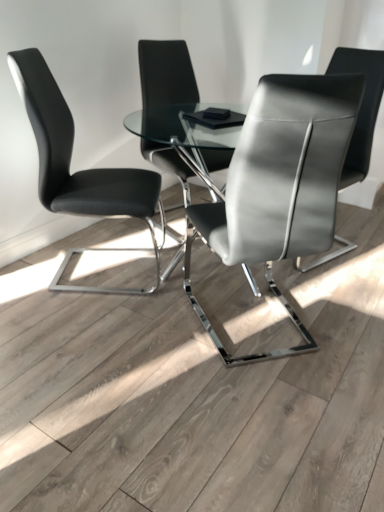
What do you see at coordinates (166, 75) in the screenshot? I see `matte black chair at center, the second chair positioned from the left` at bounding box center [166, 75].

At what (x,y) coordinates should I click in order to perform the action: click on black leather chair at left, which is counted as the 1th chair, starting from the left. Please return your answer as a coordinate pair (x, y). The image size is (384, 512). Looking at the image, I should click on [x=79, y=170].

This screenshot has width=384, height=512. What are the coordinates of `matte black chair at center, arranged as the third chair when viewed from the right` in the screenshot? It's located at (166, 75).

From the image's perspective, who appears lower, matte black chair at center, the second chair positioned from the left, or black leather chair at left, which is counted as the 1th chair, starting from the left?

black leather chair at left, which is counted as the 1th chair, starting from the left, is shown below in the image.

Considering the relative positions of matte black chair at center, arranged as the third chair when viewed from the right, and black leather chair at left, which appears as the fourth chair when viewed from the right, in the image provided, is matte black chair at center, arranged as the third chair when viewed from the right, to the left of black leather chair at left, which appears as the fourth chair when viewed from the right, from the viewer's perspective?

In fact, matte black chair at center, arranged as the third chair when viewed from the right, is to the right of black leather chair at left, which appears as the fourth chair when viewed from the right.

Is matte black chair at center, the second chair positioned from the left, further to the viewer compared to black leather chair at left, which appears as the fourth chair when viewed from the right?

Yes, the depth of matte black chair at center, the second chair positioned from the left, is greater than that of black leather chair at left, which appears as the fourth chair when viewed from the right.

What's the angular difference between matte black chair at center, arranged as the third chair when viewed from the right, and black leather chair at left, which is counted as the 1th chair, starting from the left,'s facing directions?

The angle between the facing direction of matte black chair at center, arranged as the third chair when viewed from the right, and the facing direction of black leather chair at left, which is counted as the 1th chair, starting from the left, is 53 degrees.

Is satin gray leather chair at center, marked as the second chair in a right-to-left arrangement, at the right side of matte black chair at center, arranged as the third chair when viewed from the right?

Correct, you'll find satin gray leather chair at center, marked as the second chair in a right-to-left arrangement, to the right of matte black chair at center, arranged as the third chair when viewed from the right.

Looking at this image, is satin gray leather chair at center, placed as the 3th chair when sorted from left to right, bigger or smaller than matte black chair at center, the second chair positioned from the left?

In the image, satin gray leather chair at center, placed as the 3th chair when sorted from left to right, appears to be larger than matte black chair at center, the second chair positioned from the left.

Which chair is the 3rd one when counting from the back of the satin gray leather chair at center, placed as the 3th chair when sorted from left to right? Please provide its 2D coordinates.

[(166, 75)]

Is satin gray leather chair at center, marked as the second chair in a right-to-left arrangement, turned away from matte black chair at center, the second chair positioned from the left?

That's not correct — satin gray leather chair at center, marked as the second chair in a right-to-left arrangement, is not looking away from matte black chair at center, the second chair positioned from the left.

Measure the distance from matte black chair at center, the second chair positioned from the left, to satin gray leather chair at center, marked as the second chair in a right-to-left arrangement.

The distance of matte black chair at center, the second chair positioned from the left, from satin gray leather chair at center, marked as the second chair in a right-to-left arrangement, is 37.60 inches.

Looking at this image, can you confirm if matte black chair at center, the second chair positioned from the left, is positioned to the left of satin gray leather chair at center, marked as the second chair in a right-to-left arrangement?

Correct, you'll find matte black chair at center, the second chair positioned from the left, to the left of satin gray leather chair at center, marked as the second chair in a right-to-left arrangement.

Is matte black chair at center, the second chair positioned from the left, next to satin gray leather chair at center, marked as the second chair in a right-to-left arrangement?

No, matte black chair at center, the second chair positioned from the left, is not making contact with satin gray leather chair at center, marked as the second chair in a right-to-left arrangement.

Is satin gray leather chair at center, marked as the second chair in a right-to-left arrangement, positioned with its back to satin black chair at center, positioned as the 1th chair in right-to-left order?

No, satin gray leather chair at center, marked as the second chair in a right-to-left arrangement, is not facing away from satin black chair at center, positioned as the 1th chair in right-to-left order.

Which of these two, satin gray leather chair at center, placed as the 3th chair when sorted from left to right, or satin black chair at center, the 4th chair positioned from the left, stands taller?

satin black chair at center, the 4th chair positioned from the left.

From the image's perspective, starting from the satin black chair at center, positioned as the 1th chair in right-to-left order, which chair is the 2nd one below? Please provide its 2D coordinates.

[(280, 185)]

Would you say satin gray leather chair at center, marked as the second chair in a right-to-left arrangement, is inside or outside satin black chair at center, the 4th chair positioned from the left?

satin gray leather chair at center, marked as the second chair in a right-to-left arrangement, is outside satin black chair at center, the 4th chair positioned from the left.

Between black leather chair at left, which appears as the fourth chair when viewed from the right, and matte black chair at center, the second chair positioned from the left, which one has more height?

black leather chair at left, which appears as the fourth chair when viewed from the right.

Is black leather chair at left, which appears as the fourth chair when viewed from the right, oriented towards matte black chair at center, the second chair positioned from the left?

No, black leather chair at left, which appears as the fourth chair when viewed from the right, is not aimed at matte black chair at center, the second chair positioned from the left.

Between black leather chair at left, which appears as the fourth chair when viewed from the right, and satin gray leather chair at center, placed as the 3th chair when sorted from left to right, which one has smaller width?

black leather chair at left, which appears as the fourth chair when viewed from the right, is thinner.

There is a black leather chair at left, which appears as the fourth chair when viewed from the right. Where is `the 1st chair above it (from a real-world perspective)`? Image resolution: width=384 pixels, height=512 pixels. the 1st chair above it (from a real-world perspective) is located at coordinates (280, 185).

Could you measure the distance between black leather chair at left, which appears as the fourth chair when viewed from the right, and satin gray leather chair at center, marked as the second chair in a right-to-left arrangement?

A distance of 23.64 inches exists between black leather chair at left, which appears as the fourth chair when viewed from the right, and satin gray leather chair at center, marked as the second chair in a right-to-left arrangement.

From a real-world perspective, does black leather chair at left, which appears as the fourth chair when viewed from the right, stand above satin gray leather chair at center, placed as the 3th chair when sorted from left to right?

No, from a real-world perspective, black leather chair at left, which appears as the fourth chair when viewed from the right, is not on top of satin gray leather chair at center, placed as the 3th chair when sorted from left to right.

Is point (50, 76) positioned behind point (372, 58)?

That is True.

In the image, is black leather chair at left, which appears as the fourth chair when viewed from the right, on the left side or the right side of satin black chair at center, the 4th chair positioned from the left?

From the image, it's evident that black leather chair at left, which appears as the fourth chair when viewed from the right, is to the left of satin black chair at center, the 4th chair positioned from the left.

Considering the sizes of objects black leather chair at left, which is counted as the 1th chair, starting from the left, and satin black chair at center, the 4th chair positioned from the left, in the image provided, who is taller, black leather chair at left, which is counted as the 1th chair, starting from the left, or satin black chair at center, the 4th chair positioned from the left,?

satin black chair at center, the 4th chair positioned from the left.

Would you say black leather chair at left, which appears as the fourth chair when viewed from the right, is outside satin black chair at center, the 4th chair positioned from the left?

That's correct, black leather chair at left, which appears as the fourth chair when viewed from the right, is outside of satin black chair at center, the 4th chair positioned from the left.

I want to click on chair that is the 2nd object located below the matte black chair at center, arranged as the third chair when viewed from the right (from the image's perspective), so click(x=79, y=170).

You are a GUI agent. You are given a task and a screenshot of the screen. Output one action in this format:
    pyautogui.click(x=<x>, y=<y>)
    Task: Click on the 1st chair to the left when counting from the satin gray leather chair at center, placed as the 3th chair when sorted from left to right
    Image resolution: width=384 pixels, height=512 pixels.
    Given the screenshot: What is the action you would take?
    pyautogui.click(x=166, y=75)

When comparing their distances from satin black chair at center, positioned as the 1th chair in right-to-left order, does satin gray leather chair at center, marked as the second chair in a right-to-left arrangement, or matte black chair at center, arranged as the third chair when viewed from the right, seem closer?

satin gray leather chair at center, marked as the second chair in a right-to-left arrangement, is closer to satin black chair at center, positioned as the 1th chair in right-to-left order.

From the image, which object appears to be nearer to satin black chair at center, positioned as the 1th chair in right-to-left order, satin gray leather chair at center, placed as the 3th chair when sorted from left to right, or black leather chair at left, which appears as the fourth chair when viewed from the right?

satin gray leather chair at center, placed as the 3th chair when sorted from left to right, is closer to satin black chair at center, positioned as the 1th chair in right-to-left order.

When comparing their distances from satin black chair at center, the 4th chair positioned from the left, does matte black chair at center, arranged as the third chair when viewed from the right, or satin gray leather chair at center, placed as the 3th chair when sorted from left to right, seem closer?

Among the two, satin gray leather chair at center, placed as the 3th chair when sorted from left to right, is located nearer to satin black chair at center, the 4th chair positioned from the left.

When comparing their distances from black leather chair at left, which appears as the fourth chair when viewed from the right, does matte black chair at center, the second chair positioned from the left, or satin black chair at center, positioned as the 1th chair in right-to-left order, seem closer?

matte black chair at center, the second chair positioned from the left, lies closer to black leather chair at left, which appears as the fourth chair when viewed from the right, than the other object.

Based on their spatial positions, is satin gray leather chair at center, marked as the second chair in a right-to-left arrangement, or satin black chair at center, positioned as the 1th chair in right-to-left order, further from black leather chair at left, which appears as the fourth chair when viewed from the right?

satin black chair at center, positioned as the 1th chair in right-to-left order.

Based on their spatial positions, is black leather chair at left, which is counted as the 1th chair, starting from the left, or satin black chair at center, positioned as the 1th chair in right-to-left order, further from satin gray leather chair at center, placed as the 3th chair when sorted from left to right?

black leather chair at left, which is counted as the 1th chair, starting from the left, is positioned further to the anchor satin gray leather chair at center, placed as the 3th chair when sorted from left to right.

Estimate the real-world distances between objects in this image. Which object is closer to satin gray leather chair at center, placed as the 3th chair when sorted from left to right, matte black chair at center, arranged as the third chair when viewed from the right, or satin black chair at center, positioned as the 1th chair in right-to-left order?

Among the two, satin black chair at center, positioned as the 1th chair in right-to-left order, is located nearer to satin gray leather chair at center, placed as the 3th chair when sorted from left to right.

Considering their positions, is satin black chair at center, positioned as the 1th chair in right-to-left order, positioned closer to matte black chair at center, the second chair positioned from the left, than black leather chair at left, which is counted as the 1th chair, starting from the left?

Based on the image, black leather chair at left, which is counted as the 1th chair, starting from the left, appears to be nearer to matte black chair at center, the second chair positioned from the left.